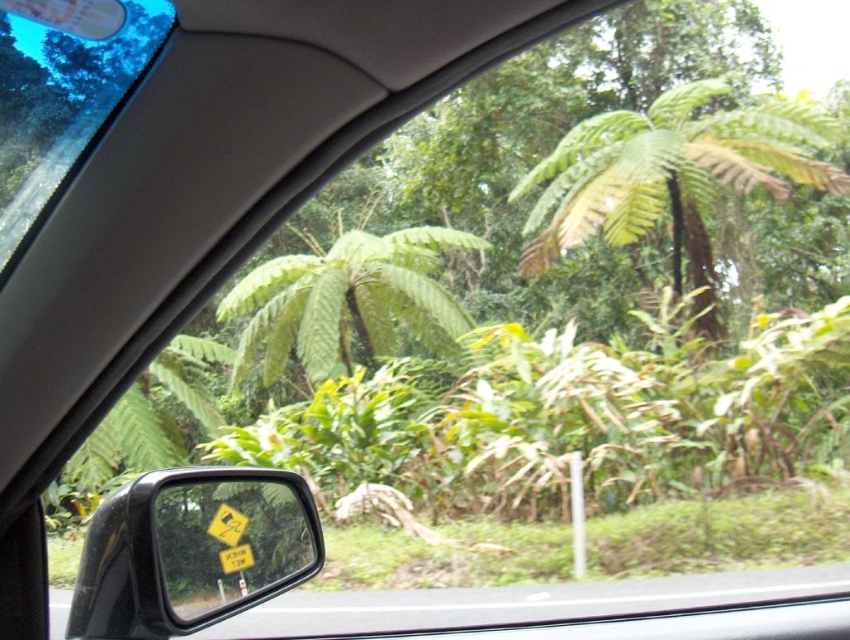
Question: Which point appears closest to the camera in this image?

Choices:
 (A) (51, 113)
 (B) (755, 150)

Answer: (A)

Question: Is black glossy view mirror at lower left to the left of green leafy tree at center from the viewer's perspective?

Choices:
 (A) no
 (B) yes

Answer: (B)

Question: Which of the following is the closest to the observer?

Choices:
 (A) (208, 586)
 (B) (313, 250)
 (C) (587, 220)
 (D) (60, 150)

Answer: (D)

Question: Which object appears closest to the camera in this image?

Choices:
 (A) transparent glass car window at upper left
 (B) green leafy tree at center
 (C) green leafy tree at upper center

Answer: (A)

Question: Can you confirm if black glossy view mirror at lower left is bigger than green leafy tree at center?

Choices:
 (A) yes
 (B) no

Answer: (B)

Question: Is green leafy tree at upper center closer to camera compared to green leafy tree at center?

Choices:
 (A) no
 (B) yes

Answer: (B)